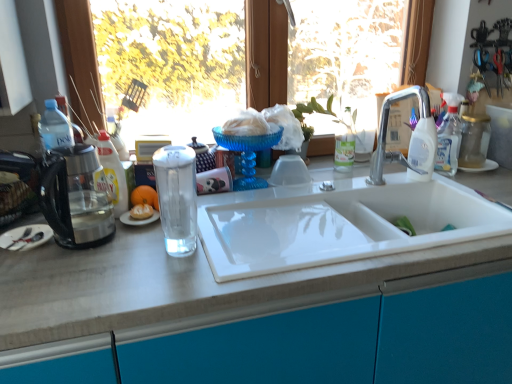
Question: From the image's perspective, is white matte countertop at center above transparent glass window at upper center?

Choices:
 (A) yes
 (B) no

Answer: (B)

Question: Is white matte countertop at center to the right of transparent glass window at upper center from the viewer's perspective?

Choices:
 (A) yes
 (B) no

Answer: (A)

Question: Would you say white matte countertop at center is a long distance from transparent glass window at upper center?

Choices:
 (A) yes
 (B) no

Answer: (B)

Question: Is the surface of white matte countertop at center in direct contact with transparent glass window at upper center?

Choices:
 (A) yes
 (B) no

Answer: (B)

Question: Does white matte countertop at center lie in front of transparent glass window at upper center?

Choices:
 (A) yes
 (B) no

Answer: (A)

Question: Is white matte countertop at center not within transparent glass window at upper center?

Choices:
 (A) yes
 (B) no

Answer: (A)

Question: Is white glossy bottle at upper right not close to transparent glass window at upper center?

Choices:
 (A) no
 (B) yes

Answer: (A)

Question: Is white glossy bottle at upper right next to transparent glass window at upper center?

Choices:
 (A) no
 (B) yes

Answer: (A)

Question: Is white glossy bottle at upper right thinner than transparent glass window at upper center?

Choices:
 (A) no
 (B) yes

Answer: (B)

Question: Considering the relative sizes of white glossy bottle at upper right and transparent glass window at upper center in the image provided, is white glossy bottle at upper right smaller than transparent glass window at upper center?

Choices:
 (A) yes
 (B) no

Answer: (A)

Question: Is white glossy bottle at upper right not inside transparent glass window at upper center?

Choices:
 (A) no
 (B) yes

Answer: (B)

Question: Can you confirm if white glossy bottle at upper right is bigger than transparent glass window at upper center?

Choices:
 (A) yes
 (B) no

Answer: (B)

Question: Considering the relative sizes of translucent glass kettle at left and white fluffy food at center in the image provided, is translucent glass kettle at left smaller than white fluffy food at center?

Choices:
 (A) no
 (B) yes

Answer: (A)